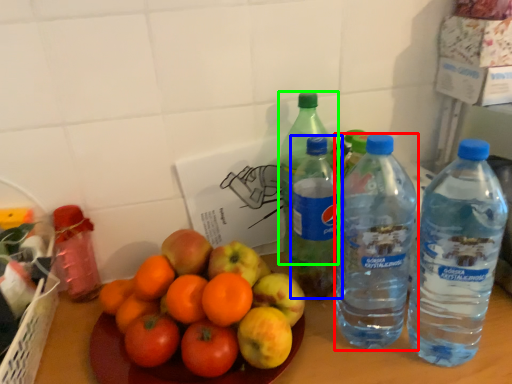
Question: Which is farther away from bottle (highlighted by a red box)? bottle (highlighted by a blue box) or bottle (highlighted by a green box)?

Choices:
 (A) bottle
 (B) bottle

Answer: (B)